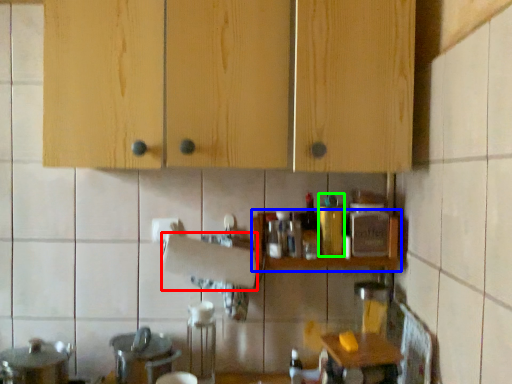
Question: Based on their relative distances, which object is nearer to paper towel (highlighted by a red box)? Choose from shelf (highlighted by a blue box) and bottle (highlighted by a green box).

Choices:
 (A) shelf
 (B) bottle

Answer: (A)